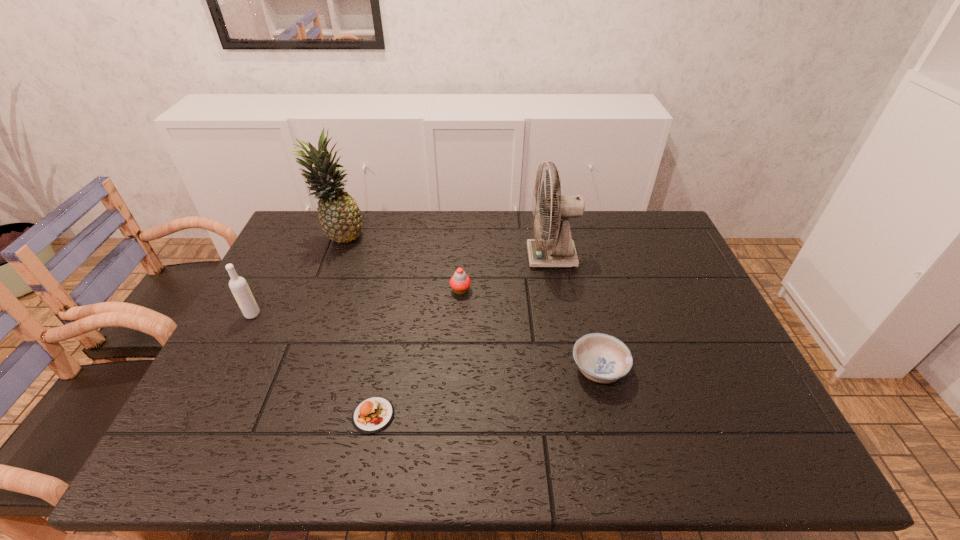
Image resolution: width=960 pixels, height=540 pixels. I want to click on object that is the closest to the fan, so click(460, 282).

This screenshot has height=540, width=960. Find the location of `free location that satisfies the following two spatial constraints: 1. on the front-facing side of the fan; 2. on the front side of the nearest object`. free location that satisfies the following two spatial constraints: 1. on the front-facing side of the fan; 2. on the front side of the nearest object is located at coordinates (582, 415).

Where is `free space that satisfies the following two spatial constraints: 1. on the back side of the leftmost object; 2. on the left side of the pineapple`? free space that satisfies the following two spatial constraints: 1. on the back side of the leftmost object; 2. on the left side of the pineapple is located at coordinates (293, 237).

Where is `vacant space that satisfies the following two spatial constraints: 1. on the front-facing side of the fan; 2. on the right side of the bowl`? The width and height of the screenshot is (960, 540). vacant space that satisfies the following two spatial constraints: 1. on the front-facing side of the fan; 2. on the right side of the bowl is located at coordinates (573, 369).